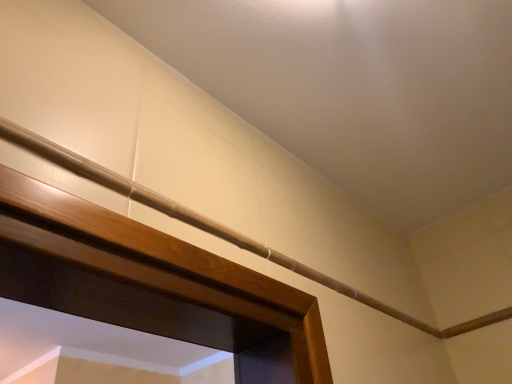
Find the location of a particular element. This screenshot has height=384, width=512. metallic pipe at upper center is located at coordinates (185, 215).

What do you see at coordinates (185, 215) in the screenshot? Image resolution: width=512 pixels, height=384 pixels. I see `metallic pipe at upper center` at bounding box center [185, 215].

In the scene shown: In order to face metallic pipe at upper center, should I rotate leftwards or rightwards?

Turn right approximately 8.299 degrees to face it.

At what (x,y) coordinates should I click in order to perform the action: click on metallic pipe at upper center. Please return your answer as a coordinate pair (x, y). Image resolution: width=512 pixels, height=384 pixels. Looking at the image, I should click on (185, 215).